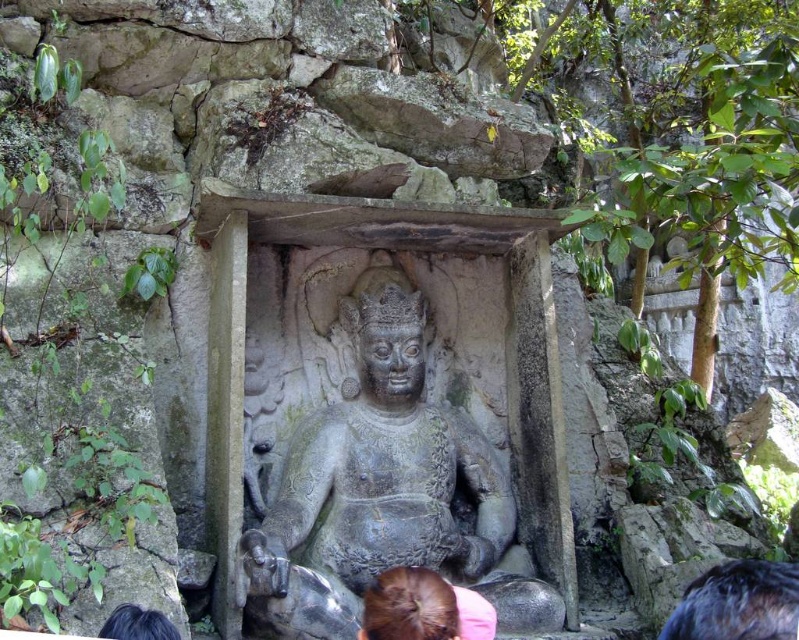
Question: Which point is closer to the camera taking this photo?

Choices:
 (A) (118, 620)
 (B) (456, 609)

Answer: (A)

Question: Can you confirm if dark brown hair at lower right is bigger than black hair at lower left?

Choices:
 (A) yes
 (B) no

Answer: (A)

Question: Which object appears farthest from the camera in this image?

Choices:
 (A) brown hair at lower center
 (B) gray stone statue at center
 (C) dark brown hair at lower right
 (D) black hair at lower left

Answer: (B)

Question: Observing the image, what is the correct spatial positioning of dark brown hair at lower right in reference to black hair at lower left?

Choices:
 (A) below
 (B) above

Answer: (A)

Question: Does dark brown hair at lower right have a smaller size compared to brown hair at lower center?

Choices:
 (A) no
 (B) yes

Answer: (A)

Question: Which object is the farthest from the dark brown hair at lower right?

Choices:
 (A) black hair at lower left
 (B) gray stone statue at center

Answer: (A)